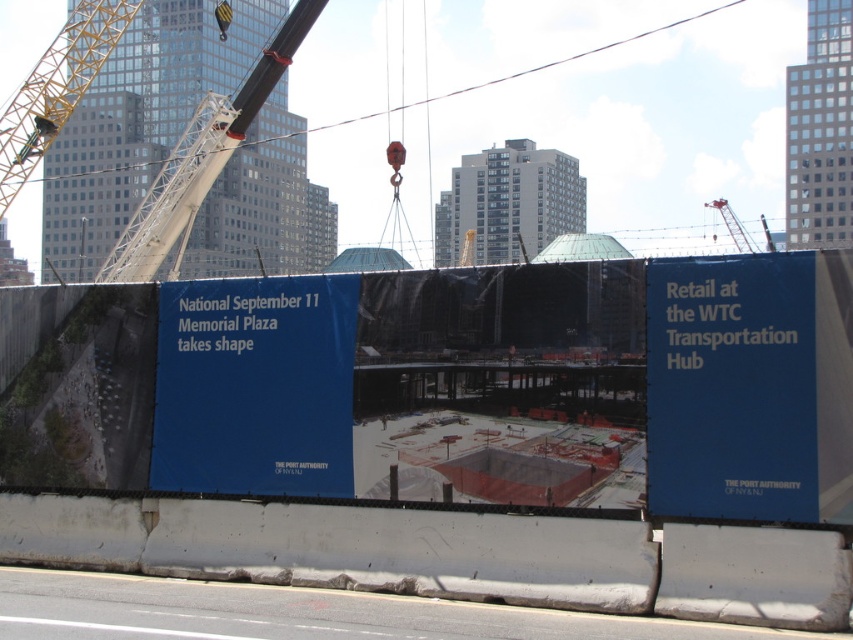
You are a construction worker standing at point (254, 385). What object is directly in front of you?

The blue fabric sign at center is directly in front of you at point (254, 385).

You are a construction worker who needs to place a new temporary sign that is 1 meter wide. You have two options for placement locations near the blue paper at upper right and the blue fabric sign at center. Which location has enough space for the sign?

The blue fabric sign at center is larger than the blue paper at upper right, so placing the sign near the blue fabric sign at center would have more space available. Since the sign is 1 meter wide, it can fit there.

You are a construction worker standing at the back of the construction site. You need to reach the point labeled as point (210, 177). However, there is an obstacle at point (351, 374). Will you encounter this obstacle before reaching your destination?

Yes, you will encounter the obstacle at point (351, 374) before reaching point (210, 177) because point (351, 374) is in front of point (210, 177).